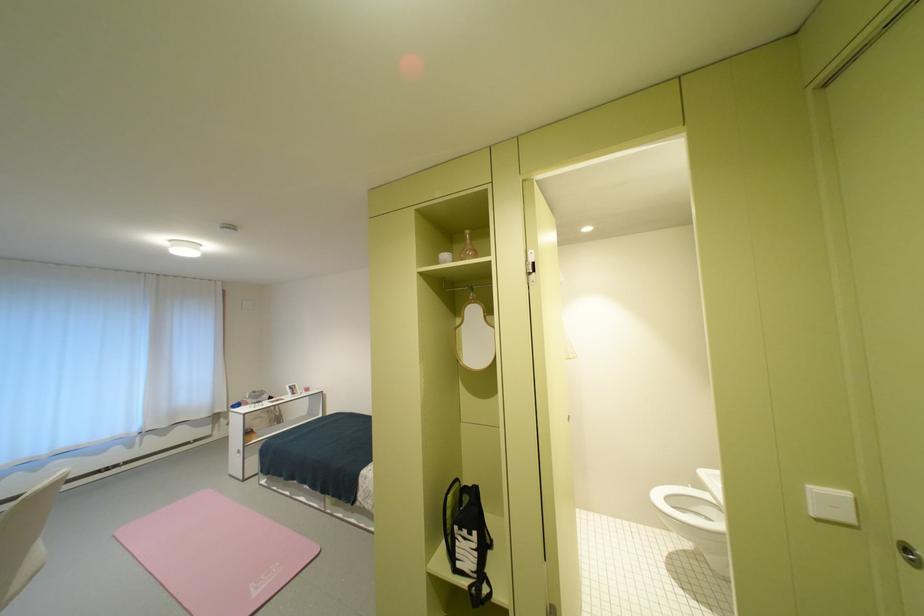
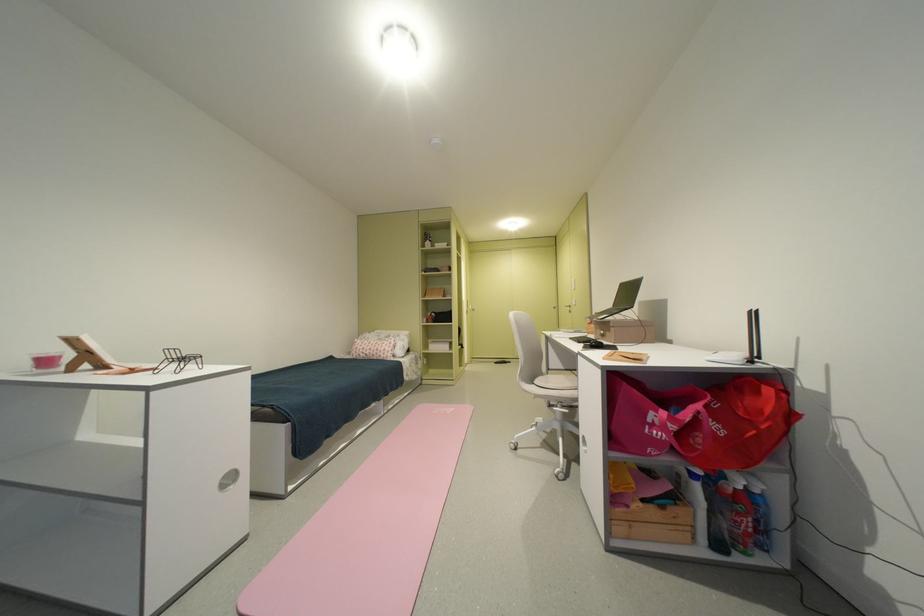
Where in the second image is the point corresponding to [286,565] from the first image?

(444, 413)